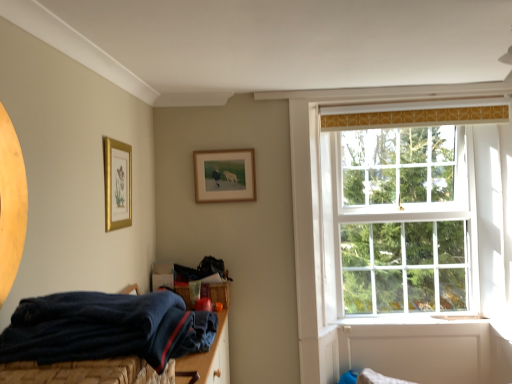
Question: Is navy blue fabric bed at lower left behind gold framed picture at upper left, the second picture frame viewed from the right?

Choices:
 (A) yes
 (B) no

Answer: (B)

Question: From a real-world perspective, is navy blue fabric bed at lower left over gold framed picture at upper left, the 1th picture frame in the front-to-back sequence?

Choices:
 (A) no
 (B) yes

Answer: (A)

Question: Can you confirm if navy blue fabric bed at lower left is wider than gold framed picture at upper left, which ranks as the 2th picture frame in back-to-front order?

Choices:
 (A) no
 (B) yes

Answer: (B)

Question: Could you tell me if navy blue fabric bed at lower left is facing gold framed picture at upper left, the second picture frame viewed from the right?

Choices:
 (A) yes
 (B) no

Answer: (B)

Question: Can you confirm if navy blue fabric bed at lower left is shorter than gold framed picture at upper left, the second picture frame viewed from the right?

Choices:
 (A) yes
 (B) no

Answer: (A)

Question: Based on their sizes in the image, would you say navy blue fabric bed at lower left is bigger or smaller than wooden frame at upper center, the 2th picture frame in the left-to-right sequence?

Choices:
 (A) small
 (B) big

Answer: (B)

Question: In the image, is navy blue fabric bed at lower left positioned in front of or behind wooden frame at upper center, placed as the 2th picture frame when sorted from front to back?

Choices:
 (A) behind
 (B) front

Answer: (B)

Question: In terms of width, does navy blue fabric bed at lower left look wider or thinner when compared to wooden frame at upper center, the 2th picture frame in the left-to-right sequence?

Choices:
 (A) wide
 (B) thin

Answer: (A)

Question: From the image's perspective, is navy blue fabric bed at lower left above or below wooden frame at upper center, which is the 1th picture frame from back to front?

Choices:
 (A) below
 (B) above

Answer: (A)

Question: Choose the correct answer: Is gold framed picture at upper left, the second picture frame viewed from the right, inside navy blue fabric bed at lower left or outside it?

Choices:
 (A) inside
 (B) outside

Answer: (B)

Question: Is gold framed picture at upper left, the second picture frame viewed from the right, to the left or to the right of navy blue fabric bed at lower left in the image?

Choices:
 (A) right
 (B) left

Answer: (B)

Question: From the image's perspective, relative to navy blue fabric bed at lower left, is gold framed picture at upper left, the second picture frame viewed from the right, above or below?

Choices:
 (A) above
 (B) below

Answer: (A)

Question: From a real-world perspective, relative to navy blue fabric bed at lower left, is gold framed picture at upper left, the second picture frame viewed from the right, vertically above or below?

Choices:
 (A) above
 (B) below

Answer: (A)

Question: From the image's perspective, is navy blue fabric bed at lower left positioned above or below gold framed picture at upper left, placed as the first picture frame when sorted from left to right?

Choices:
 (A) above
 (B) below

Answer: (B)

Question: Does point (96, 370) appear closer or farther from the camera than point (126, 193)?

Choices:
 (A) farther
 (B) closer

Answer: (B)